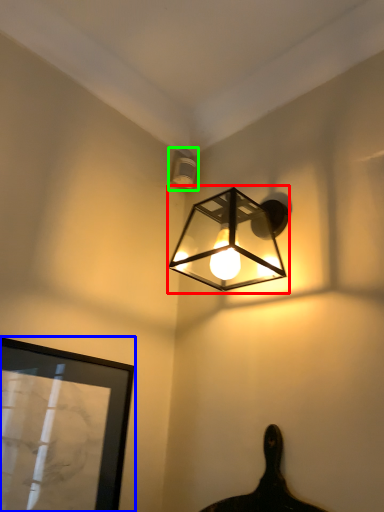
Question: Which is farther away from lamp (highlighted by a red box)? picture frame (highlighted by a blue box) or lamp (highlighted by a green box)?

Choices:
 (A) picture frame
 (B) lamp

Answer: (A)